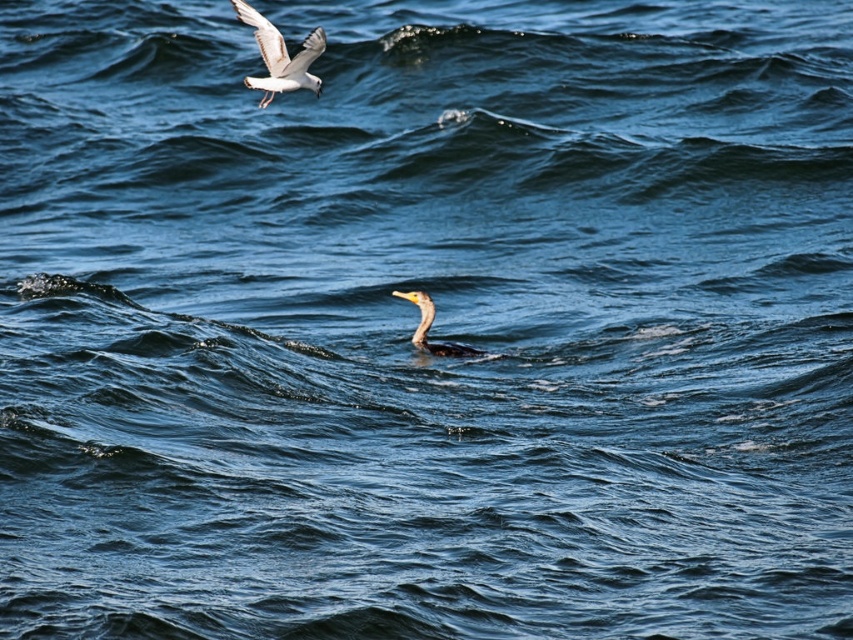
Which is more to the left, white feathered bird at upper left or shiny black duck at center?

From the viewer's perspective, white feathered bird at upper left appears more on the left side.

This screenshot has height=640, width=853. What are the coordinates of `white feathered bird at upper left` in the screenshot? It's located at (280, 56).